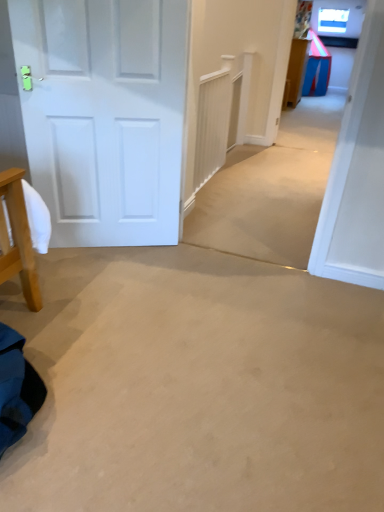
Question: Can you confirm if white matte door at left is positioned to the left of blue plastic table at upper right?

Choices:
 (A) yes
 (B) no

Answer: (A)

Question: From a real-world perspective, does white matte door at left sit lower than blue plastic table at upper right?

Choices:
 (A) yes
 (B) no

Answer: (B)

Question: Does white matte door at left turn towards blue plastic table at upper right?

Choices:
 (A) no
 (B) yes

Answer: (A)

Question: Is blue plastic table at upper right a part of white matte door at left?

Choices:
 (A) yes
 (B) no

Answer: (B)

Question: Is white matte door at left next to blue plastic table at upper right?

Choices:
 (A) yes
 (B) no

Answer: (B)

Question: From the image's perspective, is white matte door at left under blue plastic table at upper right?

Choices:
 (A) yes
 (B) no

Answer: (A)

Question: Is blue plastic table at upper right in front of white matte door at left?

Choices:
 (A) no
 (B) yes

Answer: (A)

Question: Considering the relative sizes of blue plastic table at upper right and white matte door at left in the image provided, is blue plastic table at upper right shorter than white matte door at left?

Choices:
 (A) no
 (B) yes

Answer: (B)

Question: From a real-world perspective, is blue plastic table at upper right below white matte door at left?

Choices:
 (A) yes
 (B) no

Answer: (A)

Question: Does blue plastic table at upper right contain white matte door at left?

Choices:
 (A) no
 (B) yes

Answer: (A)

Question: From the image's perspective, is blue plastic table at upper right above white matte door at left?

Choices:
 (A) yes
 (B) no

Answer: (A)

Question: Does blue plastic table at upper right appear on the right side of white matte door at left?

Choices:
 (A) no
 (B) yes

Answer: (B)

Question: In terms of width, does white matte door at left look wider or thinner when compared to blue plastic table at upper right?

Choices:
 (A) wide
 (B) thin

Answer: (B)